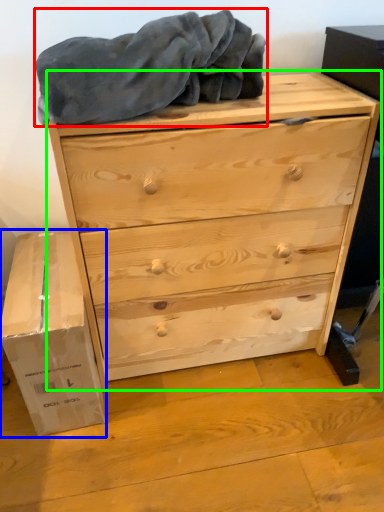
Question: Considering the real-world distances, which object is farthest from blanket (highlighted by a red box)? cardboard box (highlighted by a blue box) or chest of drawers (highlighted by a green box)?

Choices:
 (A) cardboard box
 (B) chest of drawers

Answer: (A)